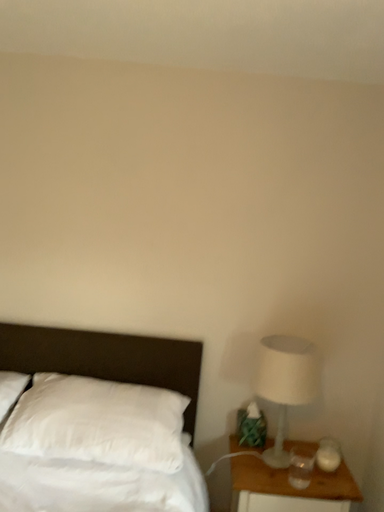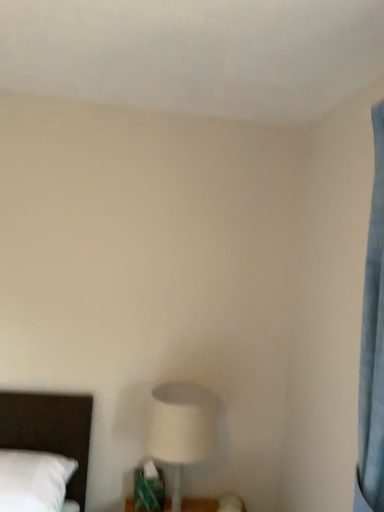
Question: Which way did the camera rotate in the video?

Choices:
 (A) rotated right
 (B) rotated left

Answer: (A)